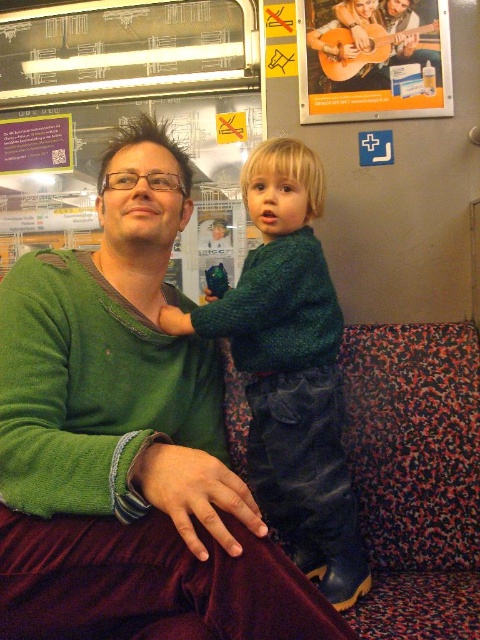
Question: Which point is closer to the camera?

Choices:
 (A) wooden guitar at upper center
 (B) green fuzzy sweater at center

Answer: (B)

Question: Can you confirm if green fuzzy sweater at center is positioned to the left of dark green sweater at center?

Choices:
 (A) yes
 (B) no

Answer: (A)

Question: From the image, what is the correct spatial relationship of dark green sweater at center in relation to wooden guitar at upper center?

Choices:
 (A) below
 (B) above

Answer: (A)

Question: Is green fuzzy sweater at center to the left of dark green sweater at center from the viewer's perspective?

Choices:
 (A) yes
 (B) no

Answer: (A)

Question: Which object is positioned closest to the dark green sweater at center?

Choices:
 (A) green fuzzy sweater at center
 (B) wooden guitar at upper center

Answer: (A)

Question: Which of the following is the farthest from the observer?

Choices:
 (A) dark green sweater at center
 (B) green fuzzy sweater at center

Answer: (A)